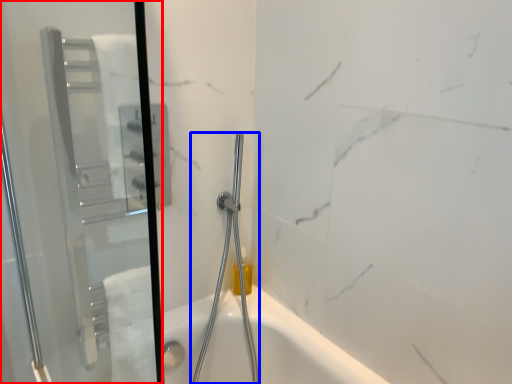
Question: Which object appears closest to the camera in this image, screen door (highlighted by a red box) or shower (highlighted by a blue box)?

Choices:
 (A) screen door
 (B) shower

Answer: (A)